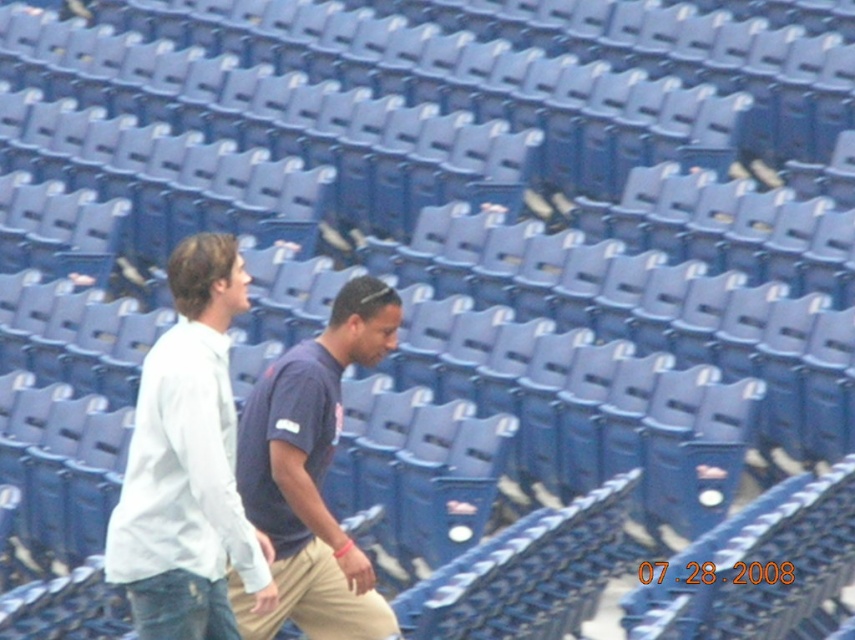
You are standing at the entrance of the stadium and see two points marked in the scene. Which point, point (x=240, y=268) or point (x=287, y=600), is closer to you?

Point (x=240, y=268) is closer to you because it is in front of point (x=287, y=600).